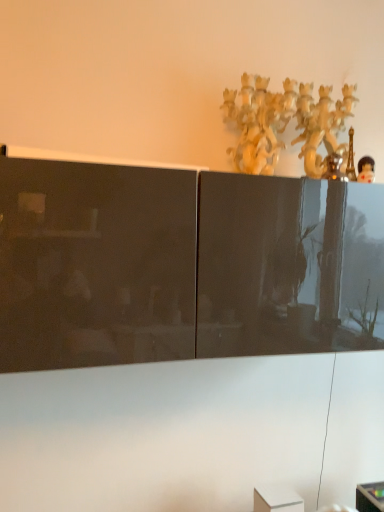
Question: Is matte black cabinet at upper center aimed at white glossy cabinet at upper center?

Choices:
 (A) no
 (B) yes

Answer: (A)

Question: Is matte black cabinet at upper center looking in the opposite direction of white glossy cabinet at upper center?

Choices:
 (A) no
 (B) yes

Answer: (A)

Question: Does matte black cabinet at upper center touch white glossy cabinet at upper center?

Choices:
 (A) no
 (B) yes

Answer: (A)

Question: From the image's perspective, is matte black cabinet at upper center beneath white glossy cabinet at upper center?

Choices:
 (A) yes
 (B) no

Answer: (A)

Question: Does matte black cabinet at upper center have a smaller size compared to white glossy cabinet at upper center?

Choices:
 (A) no
 (B) yes

Answer: (A)

Question: Can you confirm if matte black cabinet at upper center is thinner than white glossy cabinet at upper center?

Choices:
 (A) no
 (B) yes

Answer: (A)

Question: Does white glossy cabinet at upper center have a lesser height compared to polished plastic figurine at upper right?

Choices:
 (A) no
 (B) yes

Answer: (A)

Question: Does white glossy cabinet at upper center turn towards polished plastic figurine at upper right?

Choices:
 (A) yes
 (B) no

Answer: (B)

Question: Considering the relative sizes of white glossy cabinet at upper center and polished plastic figurine at upper right in the image provided, is white glossy cabinet at upper center wider than polished plastic figurine at upper right?

Choices:
 (A) yes
 (B) no

Answer: (A)

Question: Is white glossy cabinet at upper center bigger than polished plastic figurine at upper right?

Choices:
 (A) yes
 (B) no

Answer: (A)

Question: Is the depth of white glossy cabinet at upper center less than that of polished plastic figurine at upper right?

Choices:
 (A) yes
 (B) no

Answer: (B)

Question: From the image's perspective, is white glossy cabinet at upper center on polished plastic figurine at upper right?

Choices:
 (A) no
 (B) yes

Answer: (A)

Question: From a real-world perspective, is polished plastic figurine at upper right located beneath matte black cabinet at upper center?

Choices:
 (A) no
 (B) yes

Answer: (A)